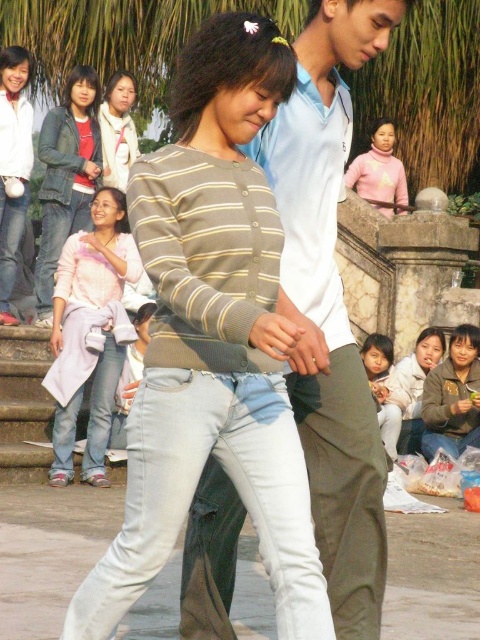
Who is lower down, pink fabric shirt at left or gray fleece jacket at lower right?

Positioned lower is gray fleece jacket at lower right.

Measure the distance between pink fabric shirt at left and gray fleece jacket at lower right.

pink fabric shirt at left and gray fleece jacket at lower right are 8.46 meters apart from each other.

Between point (81, 252) and point (477, 371), which one is positioned behind?

Positioned behind is point (477, 371).

Locate an element on the screen. The height and width of the screenshot is (640, 480). pink fabric shirt at left is located at coordinates (86, 332).

Can you confirm if light blue cotton shirt at center is taller than pink fabric shirt at left?

Correct, light blue cotton shirt at center is much taller as pink fabric shirt at left.

Which of these two, light blue cotton shirt at center or pink fabric shirt at left, stands taller?

Standing taller between the two is light blue cotton shirt at center.

Does point (360, 588) come farther from viewer compared to point (56, 300)?

That is False.

You are a GUI agent. You are given a task and a screenshot of the screen. Output one action in this format:
    pyautogui.click(x=<x>, y=<y>)
    Task: Click on the light blue cotton shirt at center
    The height and width of the screenshot is (640, 480).
    Given the screenshot: What is the action you would take?
    pyautogui.click(x=330, y=307)

Between point (49, 291) and point (384, 163), which one is positioned in front?

Point (49, 291) is in front.

Who is more distant from viewer, (80, 68) or (404, 177)?

The point (404, 177) is more distant.

Who is more forward, (51, 168) or (371, 163)?

Positioned in front is point (51, 168).

Where is `matte pink sweater at upper left`? matte pink sweater at upper left is located at coordinates (66, 177).